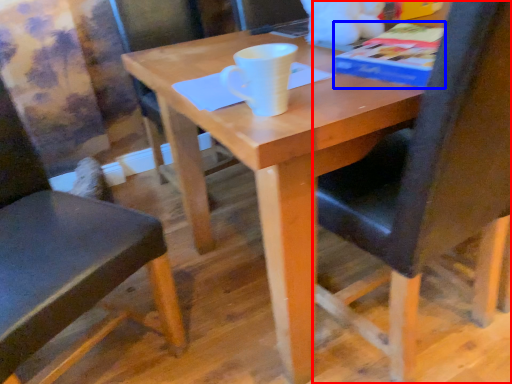
Question: Among these objects, which one is farthest to the camera, chair (highlighted by a red box) or paperback book (highlighted by a blue box)?

Choices:
 (A) chair
 (B) paperback book

Answer: (B)